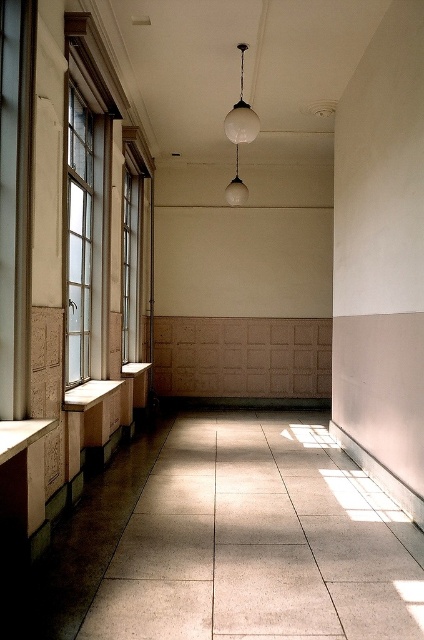
Question: Which object is closer to the camera taking this photo?

Choices:
 (A) clear glass window at left
 (B) white glass pendant light at center

Answer: (A)

Question: Is clear glass window at left below wooden bench at left?

Choices:
 (A) no
 (B) yes

Answer: (A)

Question: Does wooden bench at left come behind white glass pendant light at center?

Choices:
 (A) no
 (B) yes

Answer: (A)

Question: Which of the following is the farthest from the observer?

Choices:
 (A) white glass pendant light at center
 (B) wooden bench at left
 (C) clear glass window at left

Answer: (A)

Question: Can you confirm if wooden bench at left is thinner than white glass pendant light at center?

Choices:
 (A) no
 (B) yes

Answer: (A)

Question: Which of the following is the closest to the observer?

Choices:
 (A) clear glass window at left
 (B) white glass pendant light at center

Answer: (A)